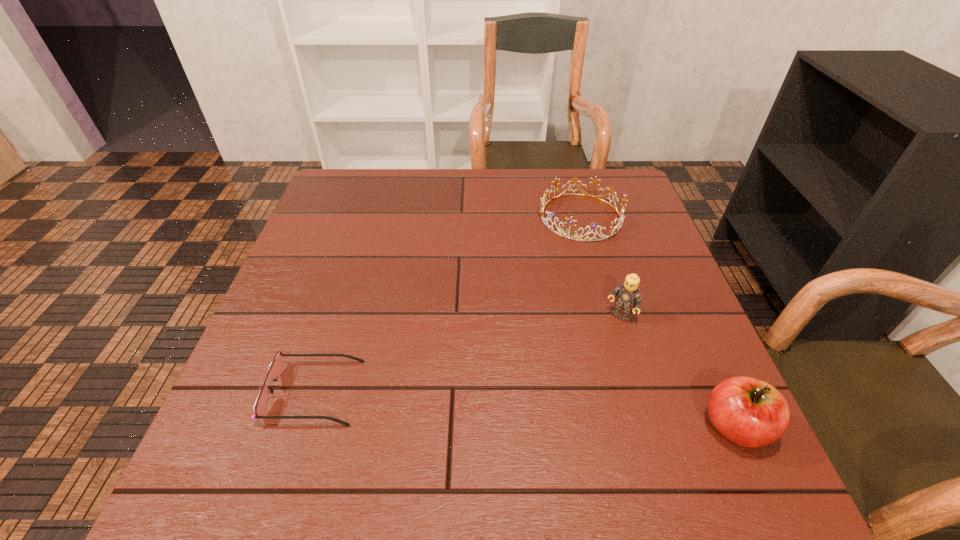
The image size is (960, 540). Identify the location of empty location between the leftmost object and the second farthest object. (467, 354).

Locate an element on the screen. The image size is (960, 540). free space between the apple and the Lego is located at coordinates pos(678,372).

Locate an element on the screen. Image resolution: width=960 pixels, height=540 pixels. free space between the Lego and the leftmost object is located at coordinates (467, 354).

Locate an element on the screen. The height and width of the screenshot is (540, 960). empty location between the third tallest object and the third nearest object is located at coordinates point(600,267).

Locate an element on the screen. The width and height of the screenshot is (960, 540). unoccupied area between the apple and the third tallest object is located at coordinates (658, 321).

Where is `vacant point located between the farthest object and the third nearest object`? vacant point located between the farthest object and the third nearest object is located at coordinates (600, 267).

Locate an element on the screen. free space that is in between the second farthest object and the sunglasses is located at coordinates (467, 354).

Find the location of `vacant area that lies between the Lego and the farthest object`. vacant area that lies between the Lego and the farthest object is located at coordinates (600, 267).

Identify the location of unoccupied area between the apple and the third nearest object. (678, 372).

Locate an element on the screen. This screenshot has height=540, width=960. vacant space in between the third nearest object and the apple is located at coordinates (678, 372).